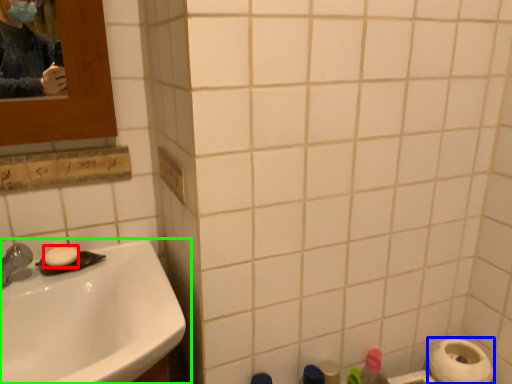
Question: Which is farther away from soap (highlighted by a red box)? toilet paper (highlighted by a blue box) or sink (highlighted by a green box)?

Choices:
 (A) toilet paper
 (B) sink

Answer: (A)